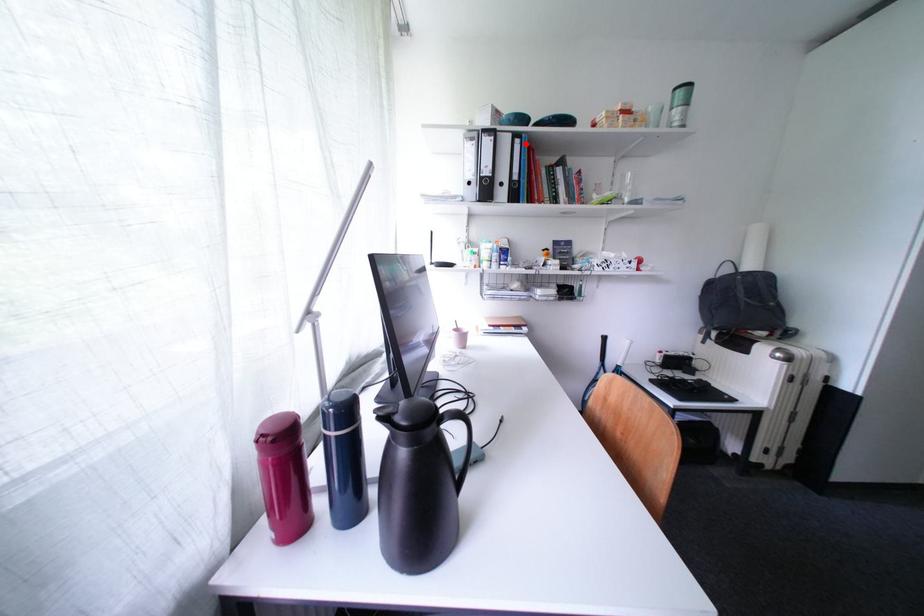
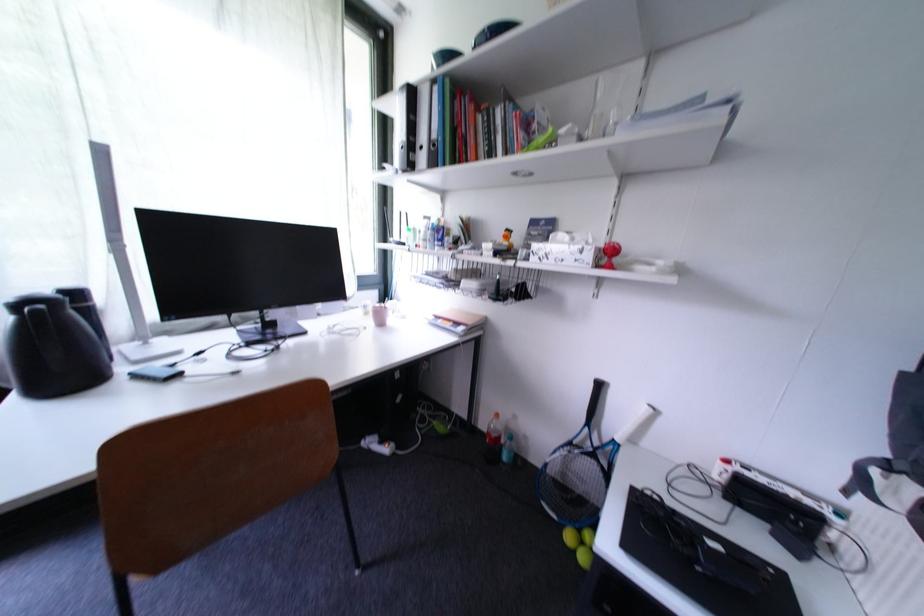
Find the pixel in the second image that matches the highlighted location in the first image.

(444, 91)